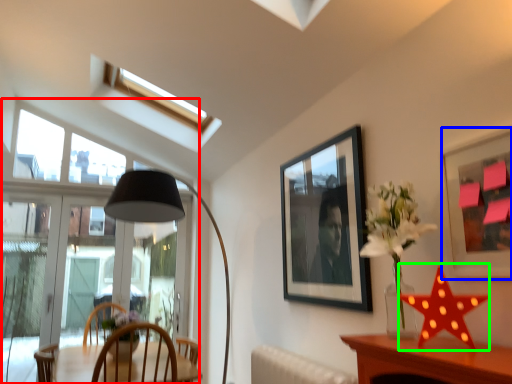
Question: Based on their relative distances, which object is farther from window (highlighted by a red box)? Choose from picture frame (highlighted by a blue box) and star (highlighted by a green box).

Choices:
 (A) picture frame
 (B) star

Answer: (B)